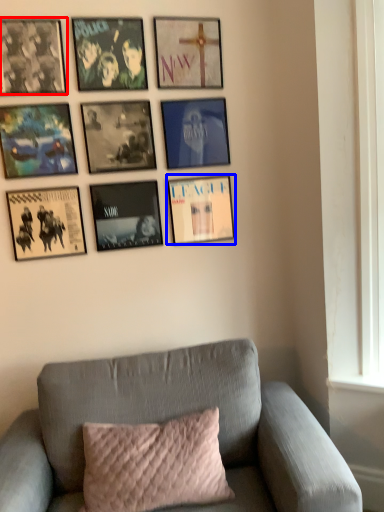
Question: Which object is closer to the camera taking this photo, picture frame (highlighted by a red box) or picture frame (highlighted by a blue box)?

Choices:
 (A) picture frame
 (B) picture frame

Answer: (A)